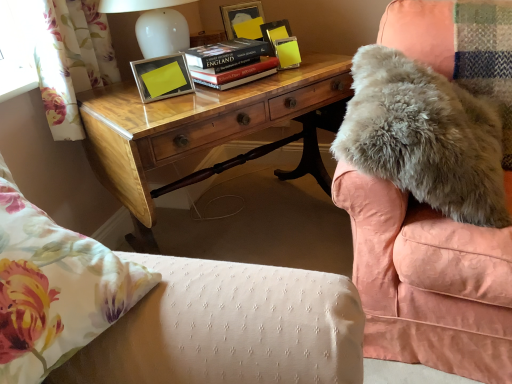
Question: In terms of width, does hardcover book at center look wider or thinner when compared to floral fabric curtain at left?

Choices:
 (A) thin
 (B) wide

Answer: (B)

Question: Do you think hardcover book at center is within floral fabric curtain at left, or outside of it?

Choices:
 (A) inside
 (B) outside

Answer: (B)

Question: Which of these objects is positioned closest to the wooden desk at center?

Choices:
 (A) floral fabric pillow at lower left
 (B) floral fabric curtain at left
 (C) fuzzy gray blanket at upper right
 (D) hardcover book at center
 (E) metallic yellow picture frame at upper center

Answer: (E)

Question: Considering the real-world distances, which object is closest to the fuzzy gray blanket at upper right?

Choices:
 (A) floral fabric curtain at left
 (B) floral fabric pillow at lower left
 (C) wooden desk at center
 (D) metallic yellow picture frame at upper center
 (E) hardcover book at center

Answer: (C)